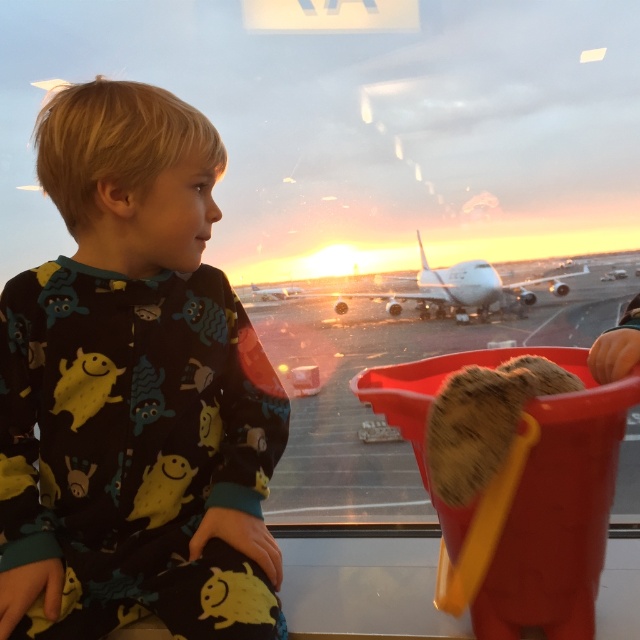
Question: From the image, what is the correct spatial relationship of black cotton pajamas at center in relation to white matte airplane at center?

Choices:
 (A) below
 (B) above

Answer: (A)

Question: Which point appears farthest from the camera in this image?

Choices:
 (A) (426, 272)
 (B) (136, 536)

Answer: (A)

Question: Can you confirm if black cotton pajamas at center is bigger than white matte airplane at center?

Choices:
 (A) no
 (B) yes

Answer: (A)

Question: Can you confirm if black cotton pajamas at center is wider than white matte airplane at center?

Choices:
 (A) yes
 (B) no

Answer: (B)

Question: Which object is closer to the camera taking this photo?

Choices:
 (A) white matte airplane at center
 (B) black cotton pajamas at center

Answer: (B)